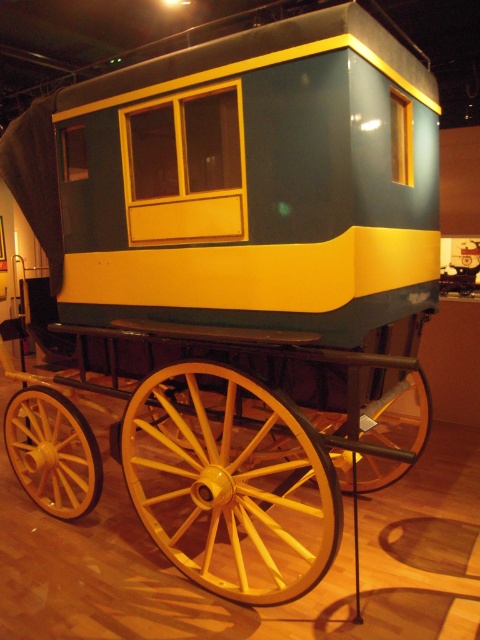
Question: Which point is closer to the camera?

Choices:
 (A) yellow wood/woven wheel at lower left
 (B) yellow wooden wagon wheel at lower center
 (C) yellow wood/wooden wheel at lower center

Answer: (C)

Question: In this image, where is yellow wooden wagon wheel at lower center located relative to yellow wood/wooden wheel at lower center?

Choices:
 (A) right
 (B) left

Answer: (B)

Question: Which is nearer to the yellow wood wagon wheel at center?

Choices:
 (A) yellow wooden wagon wheel at lower center
 (B) yellow wood/woven wheel at lower left

Answer: (A)

Question: Can you confirm if yellow wood wagon wheel at center is positioned to the left of yellow wood/wooden wheel at lower center?

Choices:
 (A) yes
 (B) no

Answer: (A)

Question: Which point appears closest to the camera in this image?

Choices:
 (A) (324, 481)
 (B) (381, 412)

Answer: (A)

Question: Can you confirm if yellow wood wagon wheel at center is positioned to the right of yellow wooden wagon wheel at lower center?

Choices:
 (A) no
 (B) yes

Answer: (B)